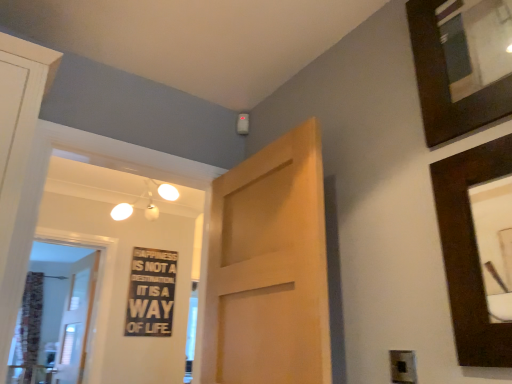
Question: Does point (394, 354) appear closer or farther from the camera than point (159, 309)?

Choices:
 (A) farther
 (B) closer

Answer: (B)

Question: Do you think black plastic electric outlet at lower right is within black wood sign at center, or outside of it?

Choices:
 (A) outside
 (B) inside

Answer: (A)

Question: Estimate the real-world distances between objects in this image. Which object is closer to the patterned fabric curtain at left?

Choices:
 (A) white wooden door at left, marked as the 1th door in a back-to-front arrangement
 (B) black wood sign at center
 (C) dark wood picture frame at upper right, the first picture frame from the top
 (D) dark wood picture frame at upper right, the second picture frame positioned from the top
 (E) black plastic electric outlet at lower right

Answer: (A)

Question: Which object is the farthest from the white wooden door at left, marked as the first door in a left-to-right arrangement?

Choices:
 (A) light brown wood door at center, the 1th door in the right-to-left sequence
 (B) white glossy light fixture at upper left
 (C) patterned fabric curtain at left
 (D) black wood sign at center
 (E) dark wood picture frame at upper right, the first picture frame from the top

Answer: (E)